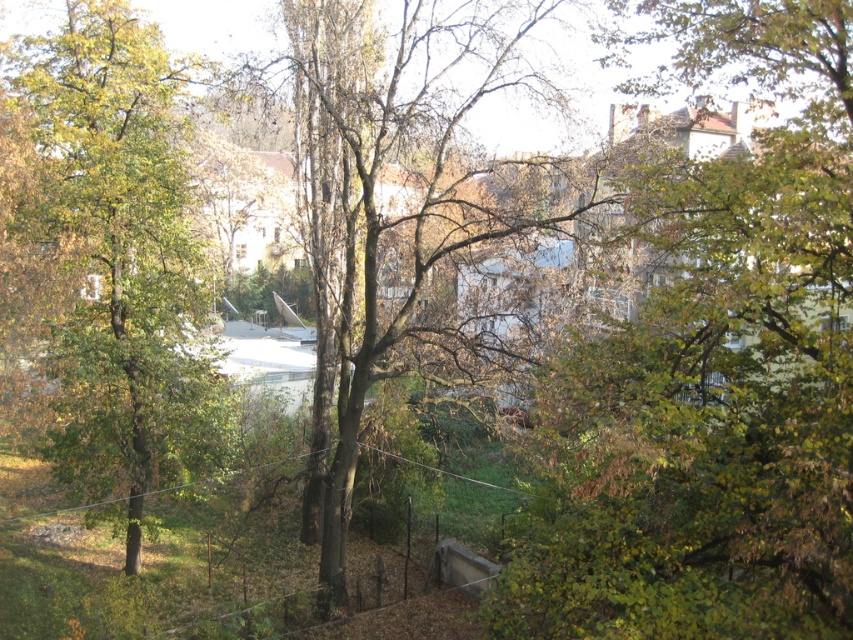
Question: Which point is closer to the camera?

Choices:
 (A) green leafy tree at upper right
 (B) green matte tree at center

Answer: (A)

Question: Which point is closer to the camera?

Choices:
 (A) (846, 522)
 (B) (71, 52)

Answer: (A)

Question: Does green leafy tree at upper right have a greater width compared to green matte tree at center?

Choices:
 (A) yes
 (B) no

Answer: (B)

Question: Is the position of green leafy tree at upper right less distant than that of green matte tree at center?

Choices:
 (A) yes
 (B) no

Answer: (A)

Question: Does green leafy tree at upper right appear over green matte tree at center?

Choices:
 (A) no
 (B) yes

Answer: (A)